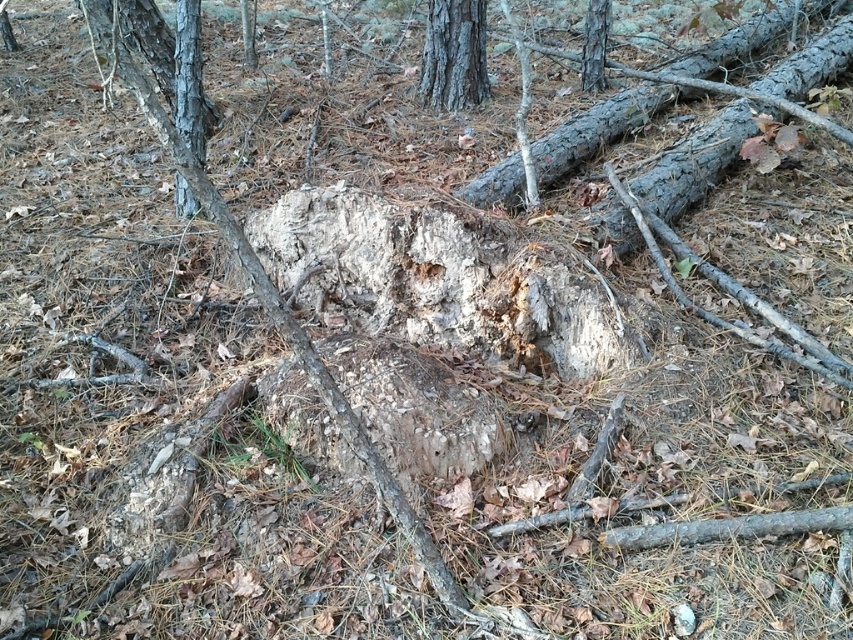
Does rough bark tree trunk at center have a smaller size compared to smooth gray bark tree at upper center?

Incorrect, rough bark tree trunk at center is not smaller in size than smooth gray bark tree at upper center.

Who is more forward, (x=103, y=44) or (x=474, y=84)?

Point (x=103, y=44) is in front.

The width and height of the screenshot is (853, 640). What do you see at coordinates (271, 301) in the screenshot? I see `rough bark tree trunk at center` at bounding box center [271, 301].

Find the location of a particular element. The width and height of the screenshot is (853, 640). rough bark tree trunk at center is located at coordinates (271, 301).

Which is above, smooth gray bark tree at upper center or smooth bark tree trunk at left?

smooth gray bark tree at upper center is above.

Between smooth gray bark tree at upper center and smooth bark tree trunk at left, which one appears on the right side from the viewer's perspective?

smooth gray bark tree at upper center is more to the right.

The height and width of the screenshot is (640, 853). What do you see at coordinates (454, 54) in the screenshot?
I see `smooth gray bark tree at upper center` at bounding box center [454, 54].

Where is `smooth gray bark tree at upper center`? This screenshot has height=640, width=853. smooth gray bark tree at upper center is located at coordinates (454, 54).

Does smooth bark tree trunk at left have a greater height compared to smooth bark tree at upper center?

Correct, smooth bark tree trunk at left is much taller as smooth bark tree at upper center.

Does point (187, 125) come closer to viewer compared to point (593, 35)?

Yes, it is.

Where is `smooth bark tree trunk at left`? Image resolution: width=853 pixels, height=640 pixels. smooth bark tree trunk at left is located at coordinates (189, 77).